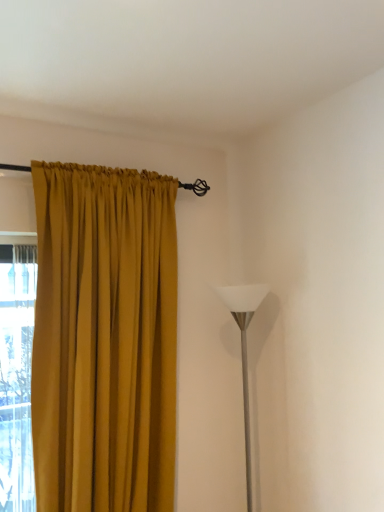
Question: Are white glossy floor lamp at right and mustard fabric curtain at left beside each other?

Choices:
 (A) yes
 (B) no

Answer: (B)

Question: Is white glossy floor lamp at right thinner than mustard fabric curtain at left?

Choices:
 (A) yes
 (B) no

Answer: (A)

Question: Would you say mustard fabric curtain at left is part of white glossy floor lamp at right's contents?

Choices:
 (A) yes
 (B) no

Answer: (B)

Question: Could you tell me if white glossy floor lamp at right is turned towards mustard fabric curtain at left?

Choices:
 (A) yes
 (B) no

Answer: (B)

Question: Is white glossy floor lamp at right in front of mustard fabric curtain at left?

Choices:
 (A) no
 (B) yes

Answer: (A)

Question: Is white glossy floor lamp at right positioned far away from mustard fabric curtain at left?

Choices:
 (A) no
 (B) yes

Answer: (A)

Question: Can you confirm if mustard fabric curtain at left is smaller than white glossy floor lamp at right?

Choices:
 (A) no
 (B) yes

Answer: (A)

Question: Is mustard fabric curtain at left located outside white glossy floor lamp at right?

Choices:
 (A) yes
 (B) no

Answer: (A)

Question: Can you confirm if mustard fabric curtain at left is thinner than white glossy floor lamp at right?

Choices:
 (A) yes
 (B) no

Answer: (B)

Question: Is mustard fabric curtain at left taller than white glossy floor lamp at right?

Choices:
 (A) yes
 (B) no

Answer: (A)

Question: Does mustard fabric curtain at left have a lesser height compared to white glossy floor lamp at right?

Choices:
 (A) yes
 (B) no

Answer: (B)

Question: From the image's perspective, is mustard fabric curtain at left on top of white glossy floor lamp at right?

Choices:
 (A) no
 (B) yes

Answer: (B)

Question: Based on their sizes in the image, would you say mustard fabric curtain at left is bigger or smaller than white glossy floor lamp at right?

Choices:
 (A) big
 (B) small

Answer: (A)